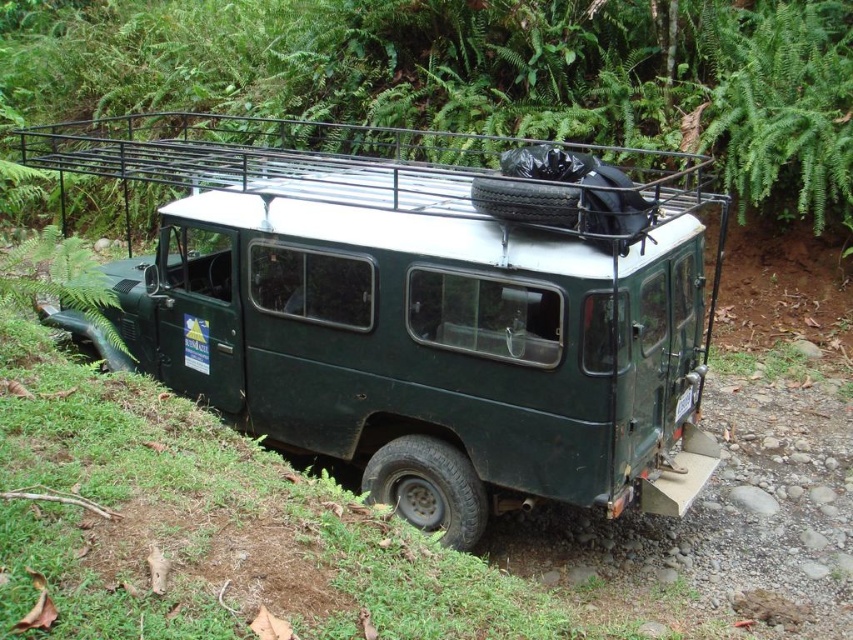
The image size is (853, 640). What are the coordinates of `green matte jeep at center` in the screenshot? It's located at (421, 312).

Where is `green matte jeep at center`? green matte jeep at center is located at coordinates (421, 312).

Between point (665, 83) and point (202, 160), which one is positioned behind?

The point (665, 83) is more distant.

The image size is (853, 640). Identify the location of green leafy vegetation at upper center. (479, 74).

You are a GUI agent. You are given a task and a screenshot of the screen. Output one action in this format:
    pyautogui.click(x=<x>, y=<y>)
    Task: Click on the green matte jeep at center
    This screenshot has height=640, width=853.
    Given the screenshot: What is the action you would take?
    pyautogui.click(x=421, y=312)

Which of these two, green matte jeep at center or green leafy vegetation at upper center, stands taller?

green leafy vegetation at upper center is taller.

What do you see at coordinates (421, 312) in the screenshot? I see `green matte jeep at center` at bounding box center [421, 312].

I want to click on green matte jeep at center, so click(x=421, y=312).